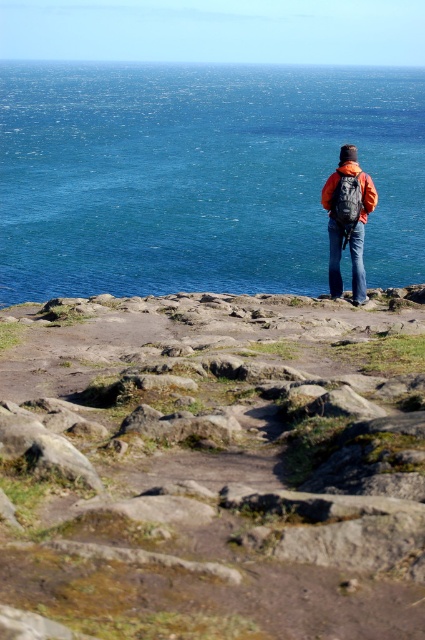
You are a hiker standing on a rocky outcrop overlooking the ocean. You notice the blue water at center and the matte orange jacket at center. From your perspective, which object is positioned to the right of the other?

The blue water at center is to the right of the matte orange jacket at center.

You are a hiker with a 3.2 meter long rope. You need to cross a gap between the rough stone path at center and a safe area. Can your rope reach the other side?

The rough stone path at center is 3.31 meters from the camera, so the gap is longer than your 3.2 meter rope. The rope will not reach.

You are a photographer trying to capture the scene with a wide angle lens. You want to ensure that both the blue water at center and the matte orange jacket at center are in focus. Based on the spatial relationship between them, will you need to adjust the depth of field to include both subjects?

The blue water at center is positioned over matte orange jacket at center, so adjusting the depth of field will help ensure both are in focus as they are layered spatially.